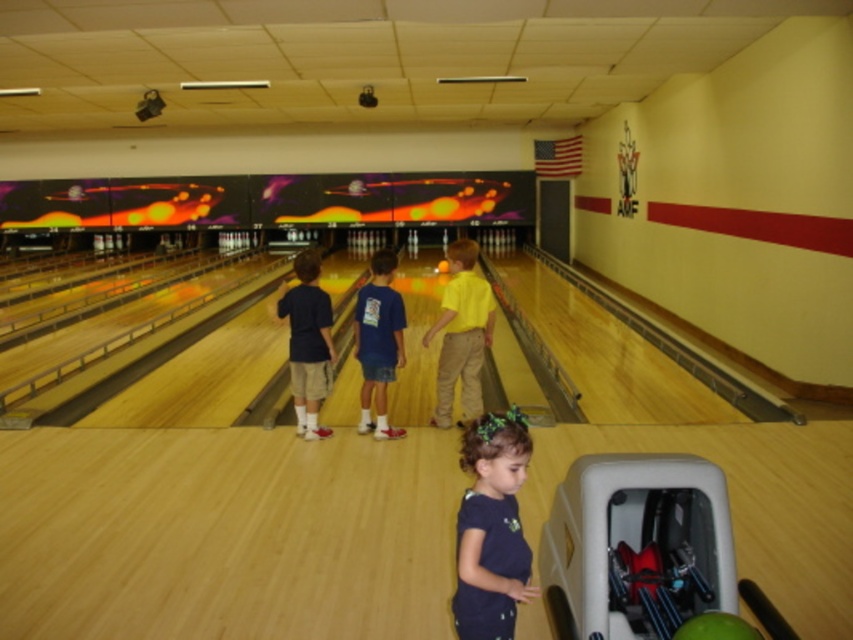
Question: Which object is farther from the camera taking this photo?

Choices:
 (A) green matte bowling ball at lower center
 (B) orange matte bowling ball at center
 (C) blue cotton shirt at center
 (D) dark blue t-shirt at center

Answer: (B)

Question: Which point appears closest to the camera in this image?

Choices:
 (A) (701, 625)
 (B) (447, 269)

Answer: (A)

Question: Does green matte bowling ball at lower center appear under orange matte bowling ball at center?

Choices:
 (A) no
 (B) yes

Answer: (B)

Question: Is matte blue shirt at center above orange matte bowling ball at center?

Choices:
 (A) no
 (B) yes

Answer: (A)

Question: Which is nearer to the orange matte bowling ball at center?

Choices:
 (A) matte blue shirt at center
 (B) dark blue t-shirt at center
 (C) yellow matte shirt at center

Answer: (C)

Question: Can you confirm if dark blue t-shirt at center is smaller than green matte bowling ball at lower center?

Choices:
 (A) no
 (B) yes

Answer: (A)